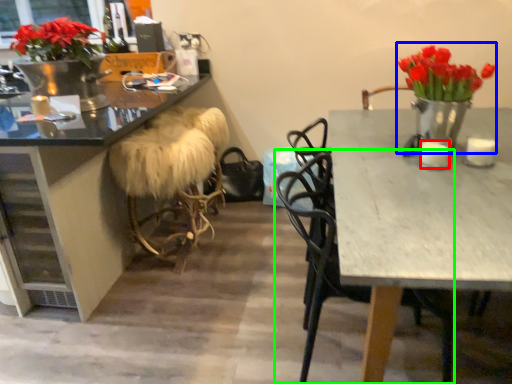
Question: Estimate the real-world distances between objects in this image. Which object is closer to candle (highlighted by a red box), floral arrangement (highlighted by a blue box) or chair (highlighted by a green box)?

Choices:
 (A) floral arrangement
 (B) chair

Answer: (A)